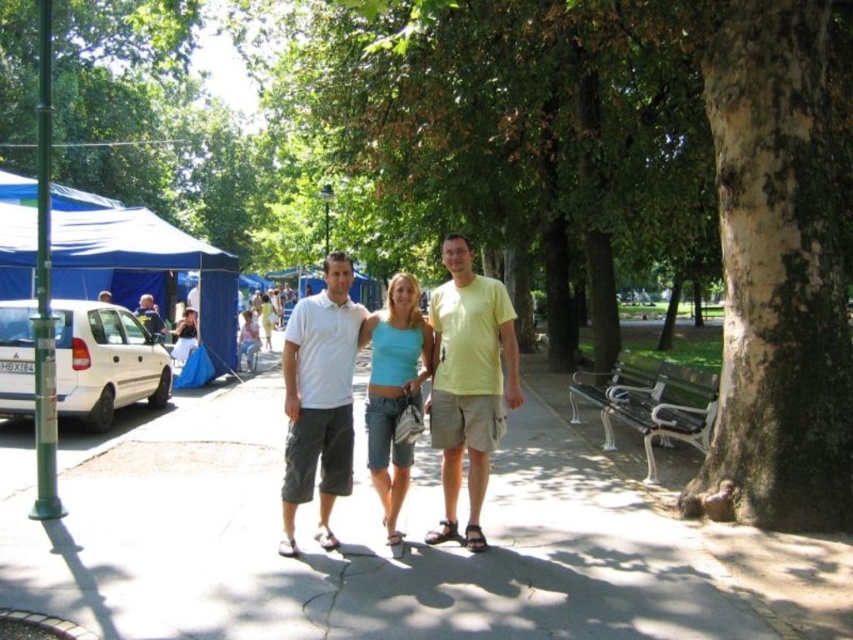
Can you confirm if blue fabric canopy at left is bigger than blue fabric tent at left?

Correct, blue fabric canopy at left is larger in size than blue fabric tent at left.

Is point (135, 230) positioned before point (178, 364)?

Yes, it is in front of point (178, 364).

Is point (0, 204) positioned before point (183, 326)?

No.

At what (x,y) coordinates should I click in order to perform the action: click on blue fabric canopy at left. Please return your answer as a coordinate pair (x, y). Image resolution: width=853 pixels, height=640 pixels. Looking at the image, I should click on (140, 262).

Is point (616, 499) positioned behind point (254, 340)?

No, (616, 499) is closer to viewer.

Which is behind, point (500, 534) or point (251, 314)?

Positioned behind is point (251, 314).

Does point (711, 560) come closer to viewer compared to point (245, 349)?

Yes, point (711, 560) is closer to viewer.

You are a GUI agent. You are given a task and a screenshot of the screen. Output one action in this format:
    pyautogui.click(x=<x>, y=<y>)
    Task: Click on the smooth concrete sidewalk at center
    
    Given the screenshot: What is the action you would take?
    pyautogui.click(x=357, y=545)

This screenshot has height=640, width=853. Identify the location of smooth bark tree trunk at right. (775, 273).

Is smooth bark tree trunk at right wider than yellow matte t-shirt at center?

Indeed, smooth bark tree trunk at right has a greater width compared to yellow matte t-shirt at center.

Between point (778, 410) and point (428, 540), which one is positioned behind?

The point (778, 410) is more distant.

Identify the location of smooth bark tree trunk at right. The width and height of the screenshot is (853, 640). (775, 273).